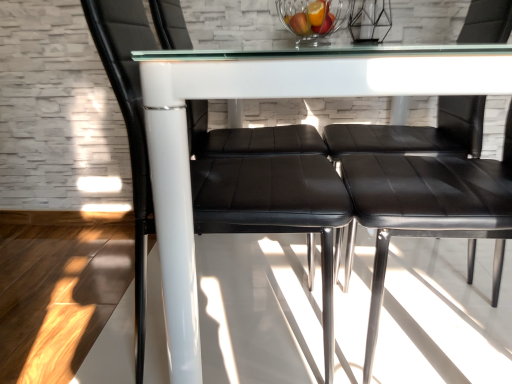
This screenshot has width=512, height=384. I want to click on black leather chair at left, positioned as the first chair in left-to-right order, so click(x=273, y=203).

The image size is (512, 384). I want to click on clear glass bowl at upper center, so (x=313, y=19).

What do you see at coordinates (313, 19) in the screenshot? I see `clear glass bowl at upper center` at bounding box center [313, 19].

Image resolution: width=512 pixels, height=384 pixels. What do you see at coordinates (271, 97) in the screenshot?
I see `transparent glass table at center` at bounding box center [271, 97].

Find the location of a particular element. The image size is (512, 384). black leather chair at left, positioned as the first chair in left-to-right order is located at coordinates (273, 203).

Does black leather chair at center, positioned as the second chair in left-to-right order, contain black leather chair at left, which is the second chair in right-to-left order?

That's incorrect, black leather chair at left, which is the second chair in right-to-left order, is not inside black leather chair at center, positioned as the second chair in left-to-right order.

Considering the positions of point (510, 21) and point (259, 197), is point (510, 21) closer or farther from the camera than point (259, 197)?

Clearly, point (510, 21) is more distant from the camera than point (259, 197).

From a real-world perspective, which is physically above, black leather chair at center, positioned as the second chair in left-to-right order, or black leather chair at left, positioned as the first chair in left-to-right order?

black leather chair at left, positioned as the first chair in left-to-right order, is physically above.

Considering the relative sizes of clear glass bowl at upper center and transparent glass table at center in the image provided, is clear glass bowl at upper center taller than transparent glass table at center?

No, clear glass bowl at upper center is not taller than transparent glass table at center.

From a real-world perspective, relative to transparent glass table at center, is clear glass bowl at upper center vertically above or below?

→ clear glass bowl at upper center is above transparent glass table at center.

From the image's perspective, would you say clear glass bowl at upper center is shown under transparent glass table at center?

Incorrect, from the image's perspective, clear glass bowl at upper center is higher than transparent glass table at center.

Which of these two, clear glass bowl at upper center or transparent glass table at center, is bigger?

transparent glass table at center.

Who is smaller, black leather chair at left, positioned as the first chair in left-to-right order, or black leather chair at center, positioned as the second chair in left-to-right order?

black leather chair at center, positioned as the second chair in left-to-right order, is smaller.

From the image's perspective, does black leather chair at left, positioned as the first chair in left-to-right order, appear lower than black leather chair at center, which is the 1th chair from right to left?

No, from the image's perspective, black leather chair at left, positioned as the first chair in left-to-right order, is not below black leather chair at center, which is the 1th chair from right to left.

You are a GUI agent. You are given a task and a screenshot of the screen. Output one action in this format:
    pyautogui.click(x=<x>, y=<y>)
    Task: Click on the chair located on the left of black leather chair at center, positioned as the second chair in left-to-right order
    
    Given the screenshot: What is the action you would take?
    pyautogui.click(x=273, y=203)

Could black leather chair at center, positioned as the second chair in left-to-right order, be considered to be inside black leather chair at left, positioned as the first chair in left-to-right order?

No, black leather chair at center, positioned as the second chair in left-to-right order, is located outside of black leather chair at left, positioned as the first chair in left-to-right order.

Considering the relative sizes of black leather chair at left, which is the second chair in right-to-left order, and clear glass bowl at upper center in the image provided, is black leather chair at left, which is the second chair in right-to-left order, shorter than clear glass bowl at upper center?

In fact, black leather chair at left, which is the second chair in right-to-left order, may be taller than clear glass bowl at upper center.

Considering the relative sizes of black leather chair at left, positioned as the first chair in left-to-right order, and clear glass bowl at upper center in the image provided, is black leather chair at left, positioned as the first chair in left-to-right order, bigger than clear glass bowl at upper center?

Correct, black leather chair at left, positioned as the first chair in left-to-right order, is larger in size than clear glass bowl at upper center.

Is point (309, 149) positioned after point (326, 4)?

No, it is not.

Looking at this image, can you tell me how much black leather chair at left, which is the second chair in right-to-left order, and transparent glass table at center differ in facing direction?

There is a 91.9-degree angle between the facing directions of black leather chair at left, which is the second chair in right-to-left order, and transparent glass table at center.

Who is smaller, black leather chair at left, which is the second chair in right-to-left order, or transparent glass table at center?

black leather chair at left, which is the second chair in right-to-left order, is smaller.

Between black leather chair at left, positioned as the first chair in left-to-right order, and transparent glass table at center, which one appears on the right side from the viewer's perspective?

From the viewer's perspective, transparent glass table at center appears more on the right side.

Starting from the transparent glass table at center, which chair is the 2nd one behind? Please provide its 2D coordinates.

[(273, 203)]

Can you confirm if transparent glass table at center is wider than black leather chair at left, positioned as the first chair in left-to-right order?

Indeed, transparent glass table at center has a greater width compared to black leather chair at left, positioned as the first chair in left-to-right order.

Is transparent glass table at center spatially inside black leather chair at left, which is the second chair in right-to-left order, or outside of it?

transparent glass table at center lies outside black leather chair at left, which is the second chair in right-to-left order.

How much distance is there between transparent glass table at center and black leather chair at left, which is the second chair in right-to-left order?

A distance of 9.54 inches exists between transparent glass table at center and black leather chair at left, which is the second chair in right-to-left order.

From the picture: Which point is more forward, (x=480, y=23) or (x=162, y=157)?

The point (x=162, y=157) is closer to the camera.

Is black leather chair at center, positioned as the second chair in left-to-right order, oriented away from transparent glass table at center?

Yes, transparent glass table at center is at the back of black leather chair at center, positioned as the second chair in left-to-right order.

Who is more distant, black leather chair at center, positioned as the second chair in left-to-right order, or transparent glass table at center?

black leather chair at center, positioned as the second chair in left-to-right order.

Is transparent glass table at center completely or partially inside black leather chair at center, positioned as the second chair in left-to-right order?

No, transparent glass table at center is located outside of black leather chair at center, positioned as the second chair in left-to-right order.

Locate an element on the screen. Image resolution: width=512 pixels, height=384 pixels. chair in front of the black leather chair at left, which is the second chair in right-to-left order is located at coordinates click(416, 133).

Find the location of a particular element. glass bowl on the left of transparent glass table at center is located at coordinates (313, 19).

Estimate the real-world distances between objects in this image. Which object is closer to transparent glass table at center, black leather chair at left, which is the second chair in right-to-left order, or black leather chair at center, positioned as the second chair in left-to-right order?

black leather chair at left, which is the second chair in right-to-left order, is closer to transparent glass table at center.

Based on their spatial positions, is black leather chair at left, which is the second chair in right-to-left order, or transparent glass table at center further from black leather chair at center, positioned as the second chair in left-to-right order?

The object further to black leather chair at center, positioned as the second chair in left-to-right order, is transparent glass table at center.

When comparing their distances from transparent glass table at center, does clear glass bowl at upper center or black leather chair at left, which is the second chair in right-to-left order, seem closer?

Among the two, black leather chair at left, which is the second chair in right-to-left order, is located nearer to transparent glass table at center.

When comparing their distances from black leather chair at center, which is the 1th chair from right to left, does black leather chair at left, positioned as the first chair in left-to-right order, or clear glass bowl at upper center seem closer?

Among the two, black leather chair at left, positioned as the first chair in left-to-right order, is located nearer to black leather chair at center, which is the 1th chair from right to left.

From the image, which object appears to be nearer to black leather chair at left, positioned as the first chair in left-to-right order, transparent glass table at center or clear glass bowl at upper center?

transparent glass table at center is positioned closer to the anchor black leather chair at left, positioned as the first chair in left-to-right order.

Estimate the real-world distances between objects in this image. Which object is further from black leather chair at left, which is the second chair in right-to-left order, clear glass bowl at upper center or black leather chair at center, positioned as the second chair in left-to-right order?

clear glass bowl at upper center is positioned further to the anchor black leather chair at left, which is the second chair in right-to-left order.

Based on their spatial positions, is black leather chair at left, positioned as the first chair in left-to-right order, or clear glass bowl at upper center closer to transparent glass table at center?

The object closer to transparent glass table at center is black leather chair at left, positioned as the first chair in left-to-right order.

Estimate the real-world distances between objects in this image. Which object is further from black leather chair at left, which is the second chair in right-to-left order, transparent glass table at center or black leather chair at center, positioned as the second chair in left-to-right order?

black leather chair at center, positioned as the second chair in left-to-right order.

This screenshot has height=384, width=512. Identify the location of chair located between black leather chair at center, which is the 1th chair from right to left, and clear glass bowl at upper center in the depth direction. (273, 203).

At what (x,y) coordinates should I click in order to perform the action: click on table located between black leather chair at left, positioned as the first chair in left-to-right order, and black leather chair at center, positioned as the second chair in left-to-right order, in the left-right direction. Please return your answer as a coordinate pair (x, y). Looking at the image, I should click on (271, 97).